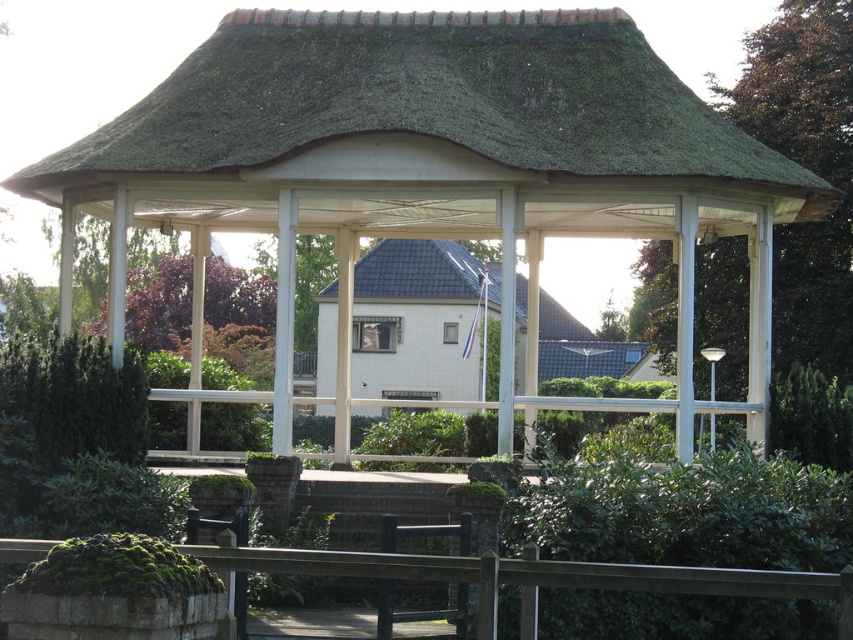
Question: Is dark green leafy tree at upper right positioned before dark gray shingles at center?

Choices:
 (A) no
 (B) yes

Answer: (B)

Question: Based on their relative distances, which object is farther from the green thatch roof at center?

Choices:
 (A) white wooden gazebo at center
 (B) dark green leafy tree at upper right
 (C) dark gray shingles at center

Answer: (C)

Question: Among these points, which one is nearest to the camera?

Choices:
 (A) (392, 260)
 (B) (223, 118)
 (C) (808, 32)

Answer: (B)

Question: Can you confirm if white wooden gazebo at center is bigger than green thatch roof at center?

Choices:
 (A) yes
 (B) no

Answer: (A)

Question: Can you confirm if dark green leafy tree at upper right is smaller than dark gray shingles at center?

Choices:
 (A) no
 (B) yes

Answer: (A)

Question: Which point is closer to the camera?

Choices:
 (A) white wooden gazebo at center
 (B) dark green leafy tree at upper right
 (C) green thatch roof at center
 (D) dark gray shingles at center

Answer: (C)